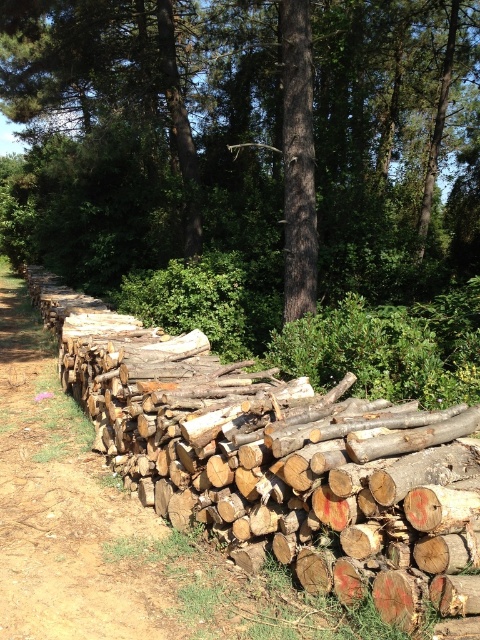
You are a hiker who just entered the forest and see the natural wood logs at left and the brown rough tree trunk at center. Which object is nearer to you?

The natural wood logs at left are closer to the viewer than the brown rough tree trunk at center.

You are a forest ranger inspecting the area. You notice the brown wood log at center and the brown rough tree trunk at center. Which object is closer to you?

The brown wood log at center is positioned over the brown rough tree trunk at center, so the brown wood log at center is closer to you.